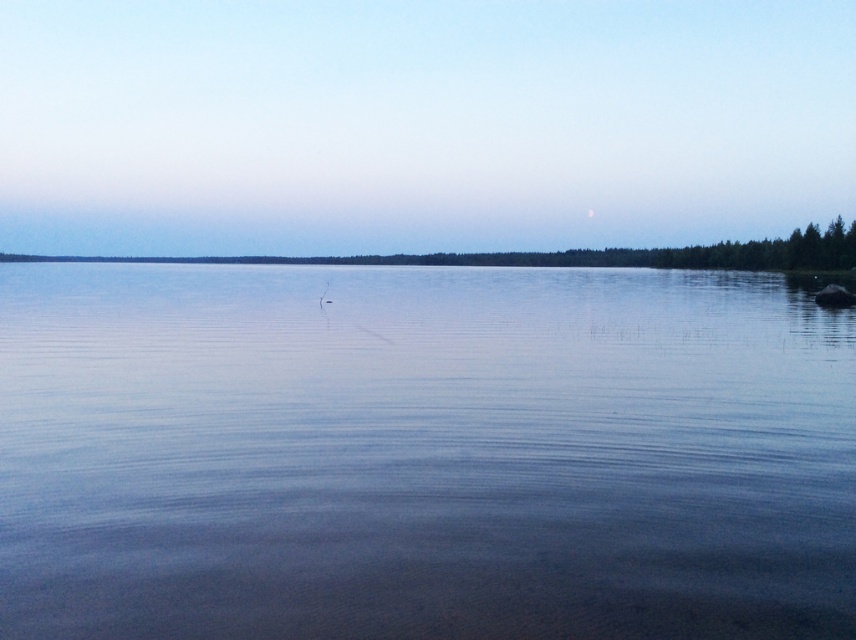
Question: Is transparent water at center below blue sky at upper center?

Choices:
 (A) yes
 (B) no

Answer: (A)

Question: Which point is farther to the camera?

Choices:
 (A) (76, 358)
 (B) (806, 240)

Answer: (B)

Question: Is transparent water at center wider than blue sky at upper center?

Choices:
 (A) no
 (B) yes

Answer: (A)

Question: Is transparent water at center behind blue sky at upper center?

Choices:
 (A) no
 (B) yes

Answer: (A)

Question: Which point is farther from the camera taking this photo?

Choices:
 (A) (399, 470)
 (B) (824, 241)

Answer: (B)